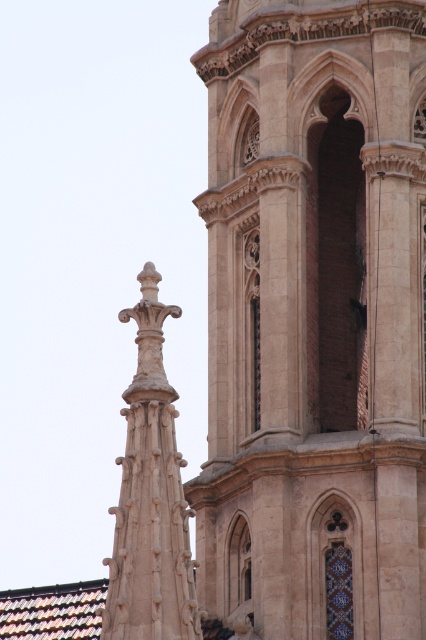
Does beige stone tower at center have a greater height compared to carved stone spire at upper left?

Indeed, beige stone tower at center has a greater height compared to carved stone spire at upper left.

Between beige stone tower at center and carved stone spire at upper left, which one appears on the left side from the viewer's perspective?

carved stone spire at upper left is more to the left.

Describe the element at coordinates (314, 316) in the screenshot. I see `beige stone tower at center` at that location.

At what (x,y) coordinates should I click in order to perform the action: click on beige stone tower at center. Please return your answer as a coordinate pair (x, y). The width and height of the screenshot is (426, 640). Looking at the image, I should click on (314, 316).